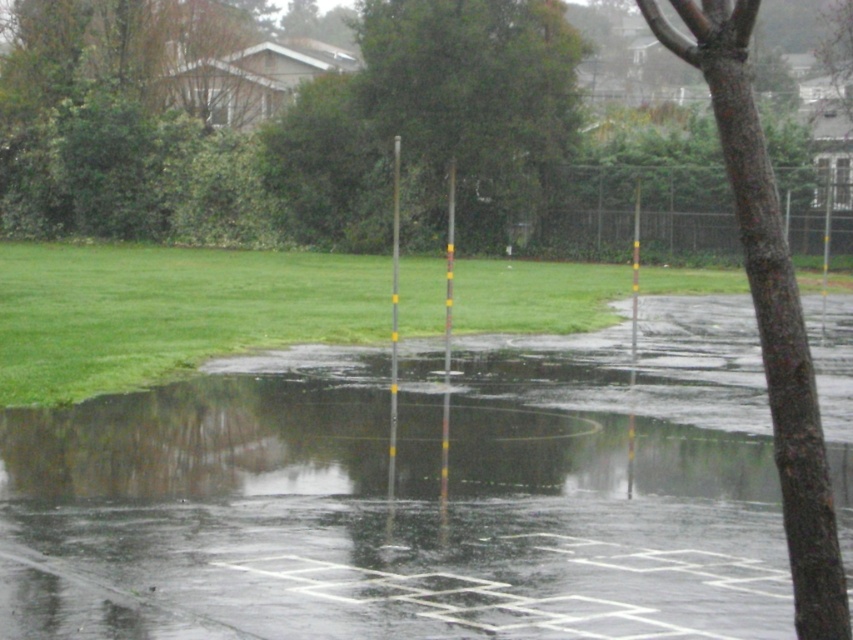
Does transparent wet pavement at center have a smaller size compared to yellow plastic pole at right?

Indeed, transparent wet pavement at center has a smaller size compared to yellow plastic pole at right.

Does transparent wet pavement at center have a greater width compared to yellow plastic pole at right?

Yes.

At what (x,y) coordinates should I click in order to perform the action: click on transparent wet pavement at center. Please return your answer as a coordinate pair (x, y). The image size is (853, 640). Looking at the image, I should click on (399, 508).

Is yellow painted metal pole at center above yellow plastic pole at right?

Actually, yellow painted metal pole at center is below yellow plastic pole at right.

Who is taller, yellow painted metal pole at center or yellow plastic pole at right?

yellow painted metal pole at center

The image size is (853, 640). I want to click on yellow painted metal pole at center, so click(393, 321).

Locate an element on the screen. The image size is (853, 640). yellow painted metal pole at center is located at coordinates (393, 321).

Is green leafy tree at upper center to the left of yellow plastic pole at right from the viewer's perspective?

Yes, green leafy tree at upper center is to the left of yellow plastic pole at right.

Locate an element on the screen. The image size is (853, 640). green leafy tree at upper center is located at coordinates (471, 102).

At what (x,y) coordinates should I click in order to perform the action: click on green leafy tree at upper center. Please return your answer as a coordinate pair (x, y). Looking at the image, I should click on (471, 102).